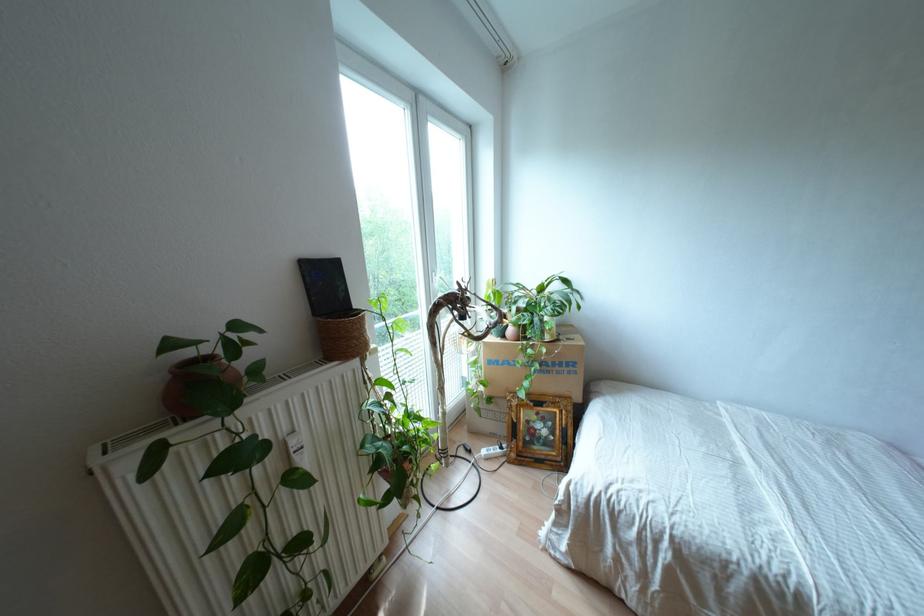
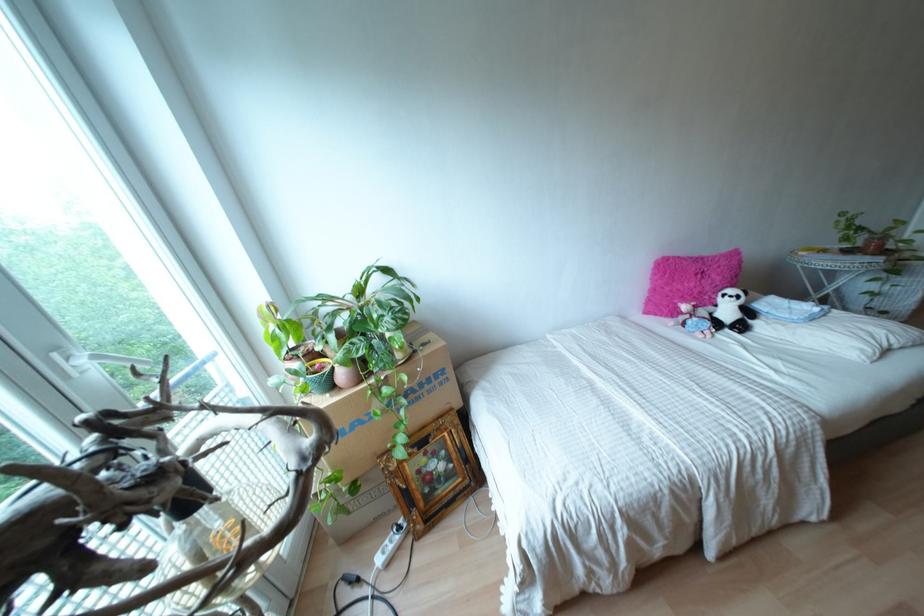
In the second image, find the point that corresponds to point (509, 330) in the first image.

(342, 374)